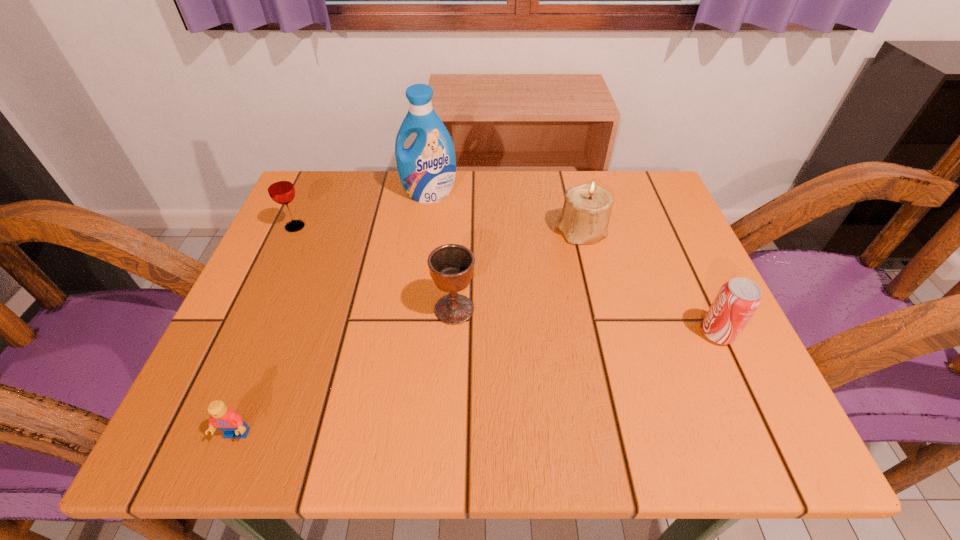
Image resolution: width=960 pixels, height=540 pixels. I want to click on vacant space that satisfies the following two spatial constraints: 1. on the logo side of the rightmost object; 2. on the face of the nearest object, so click(x=765, y=435).

This screenshot has height=540, width=960. Identify the location of free space that satisfies the following two spatial constraints: 1. on the front-facing side of the detergent; 2. on the right side of the chalice. (414, 309).

This screenshot has height=540, width=960. What are the coordinates of `vacant space that satisfies the following two spatial constraints: 1. on the logo side of the soda can; 2. on the face of the Lego` in the screenshot? It's located at (765, 435).

At what (x,y) coordinates should I click in order to perform the action: click on free region that satisfies the following two spatial constraints: 1. on the logo side of the soda can; 2. on the face of the Lego. Please return your answer as a coordinate pair (x, y). Looking at the image, I should click on (765, 435).